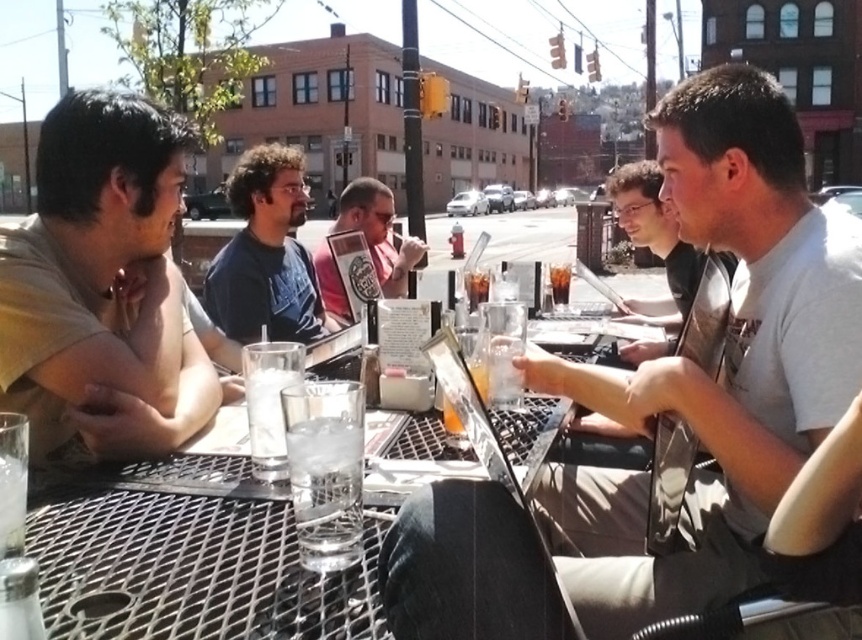
Question: Among these objects, which one is nearest to the camera?

Choices:
 (A) light beige shirt at left
 (B) dark brown glass at center

Answer: (A)

Question: Is metallic mesh table at center further to the viewer compared to translucent glass cup at center?

Choices:
 (A) yes
 (B) no

Answer: (B)

Question: Which object is the farthest from the translucent glass cup at center?

Choices:
 (A) pink fabric shirt at center
 (B) clear glass at table left
 (C) clear glass at table center

Answer: (A)

Question: Can you confirm if light beige shirt at left is thinner than clear glass water at center?

Choices:
 (A) no
 (B) yes

Answer: (A)

Question: Which point is closer to the camera?

Choices:
 (A) clear glass at table left
 (B) translucent glass cup at center
 (C) dark brown glass at center

Answer: (A)

Question: Can you confirm if translucent glass cup at center is smaller than translucent glass at center?

Choices:
 (A) no
 (B) yes

Answer: (B)